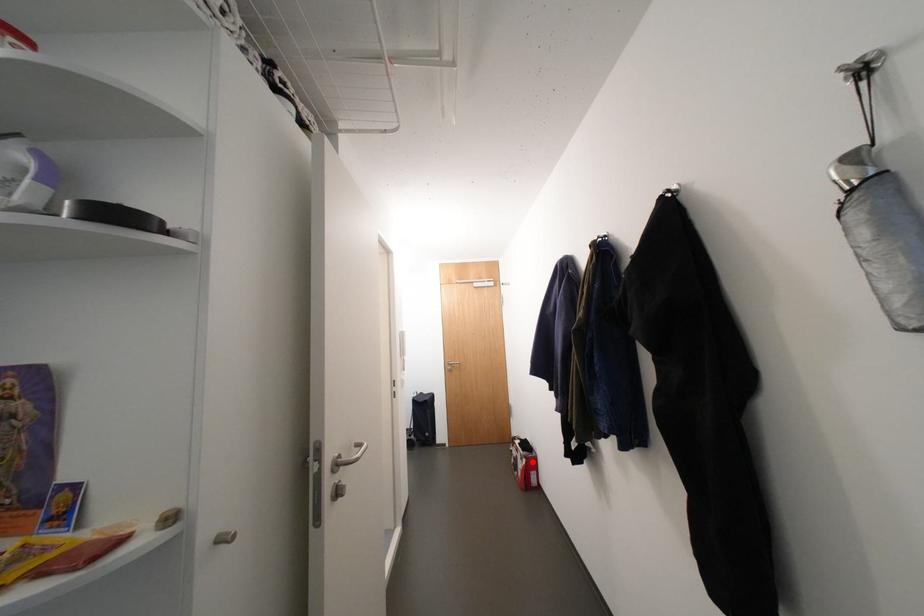
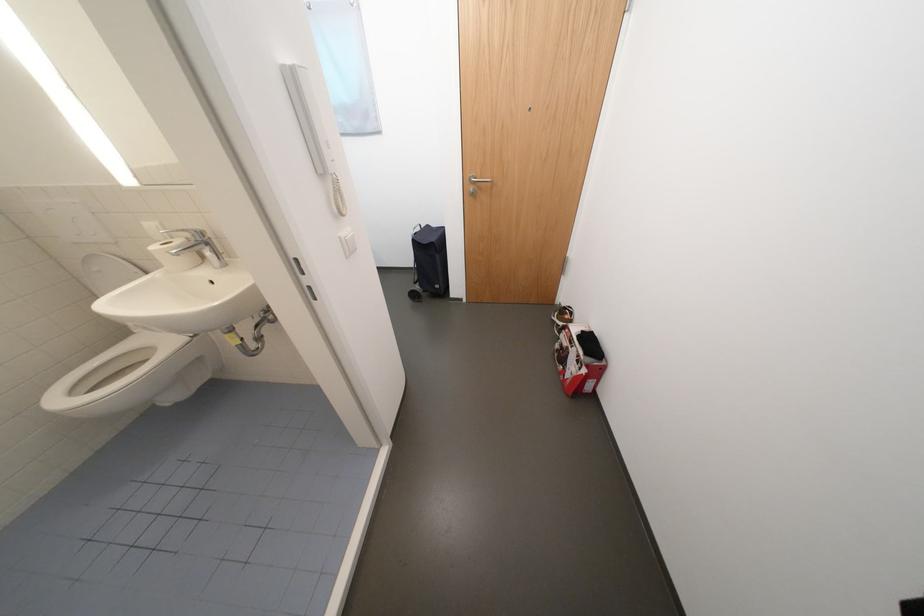
Question: I am providing you with two images of the same scene from different viewpoints. In image1, a red point is highlighted. Considering the same 3D point in image2, which of the following is correct?

Choices:
 (A) It is closer
 (B) It is farther

Answer: (A)